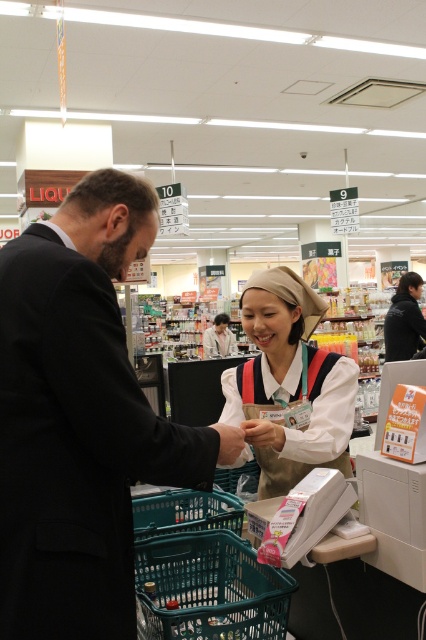
Question: Which point is closer to the camera taking this photo?

Choices:
 (A) (253, 308)
 (B) (42, 604)
 (C) (412, 328)

Answer: (B)

Question: In this image, where is black suit at left located relative to black fabric jacket at upper right?

Choices:
 (A) below
 (B) above

Answer: (A)

Question: Among these objects, which one is nearest to the camera?

Choices:
 (A) white fabric uniform at center
 (B) black suit at left
 (C) black fabric jacket at upper right

Answer: (B)

Question: Can you confirm if black suit at left is wider than black fabric jacket at upper right?

Choices:
 (A) no
 (B) yes

Answer: (B)

Question: Where is black suit at left located in relation to black fabric jacket at upper right in the image?

Choices:
 (A) above
 (B) below

Answer: (B)

Question: Considering the real-world distances, which object is farthest from the black fabric jacket at upper right?

Choices:
 (A) black suit at left
 (B) white fabric uniform at center

Answer: (A)